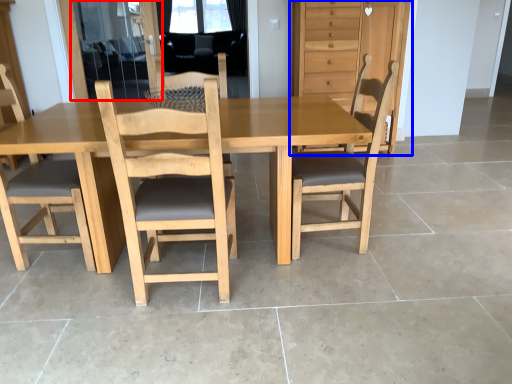
Question: Which object appears farthest to the camera in this image, screen door (highlighted by a red box) or dresser (highlighted by a blue box)?

Choices:
 (A) screen door
 (B) dresser

Answer: (A)